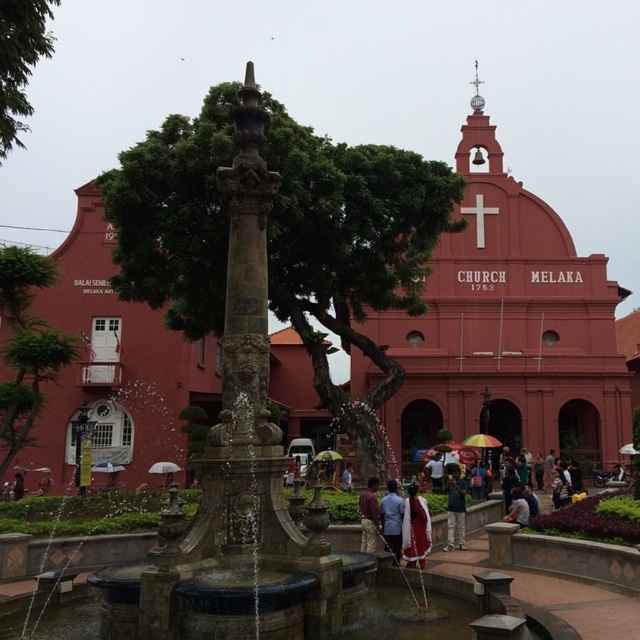
Question: Among these points, which one is farthest from the camera?

Choices:
 (A) (38, 29)
 (B) (451, 529)

Answer: (A)

Question: Among these points, which one is nearest to the camera?

Choices:
 (A) pos(435,170)
 (B) pos(369,484)

Answer: (B)

Question: Is green fabric umbrella at center to the left of light blue shirt at center from the viewer's perspective?

Choices:
 (A) no
 (B) yes

Answer: (A)

Question: Can you confirm if green leafy tree at left is positioned to the right of green fabric umbrella at center?

Choices:
 (A) yes
 (B) no

Answer: (B)

Question: Can you confirm if green leafy tree at left is positioned above maroon fabric dress at center?

Choices:
 (A) no
 (B) yes

Answer: (B)

Question: Which of the following is the closest to the observer?

Choices:
 (A) maroon fabric dress at center
 (B) light blue fabric umbrella at center

Answer: (A)